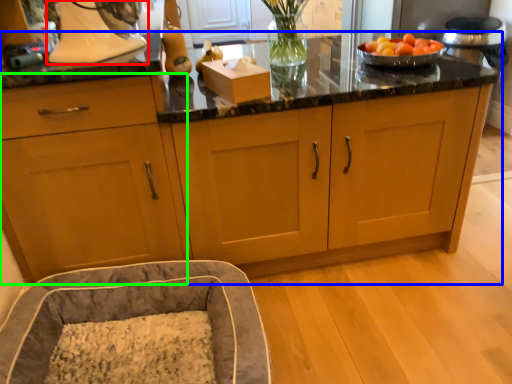
Question: Which object is the farthest from home appliance (highlighted by a red box)? Choose among these: cabinetry (highlighted by a blue box) or cabinetry (highlighted by a green box).

Choices:
 (A) cabinetry
 (B) cabinetry

Answer: (A)